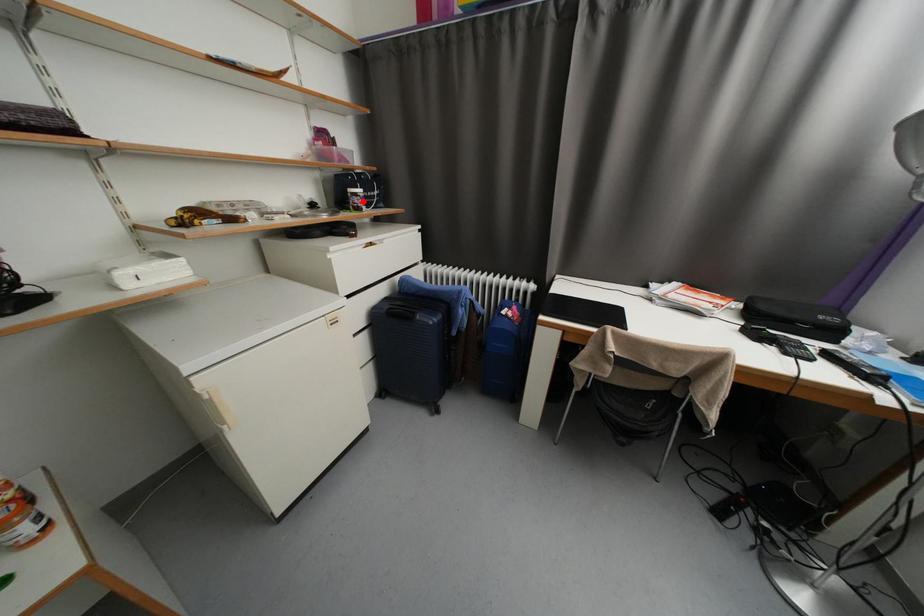
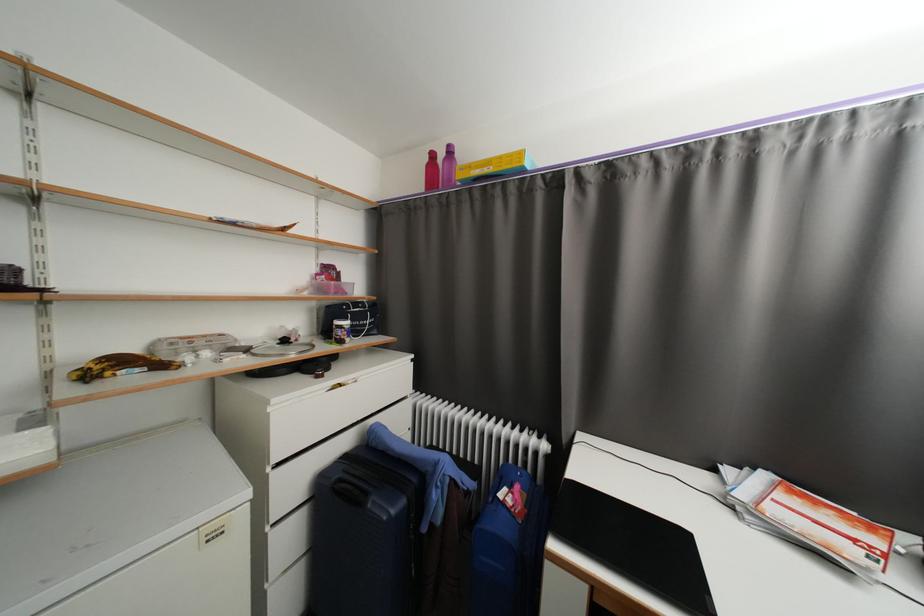
Question: I am providing you with two images of the same scene from different viewpoints. Given a red point in image1, look at the same physical point in image2. Is it:

Choices:
 (A) Closer to the viewpoint
 (B) Farther from the viewpoint

Answer: (B)